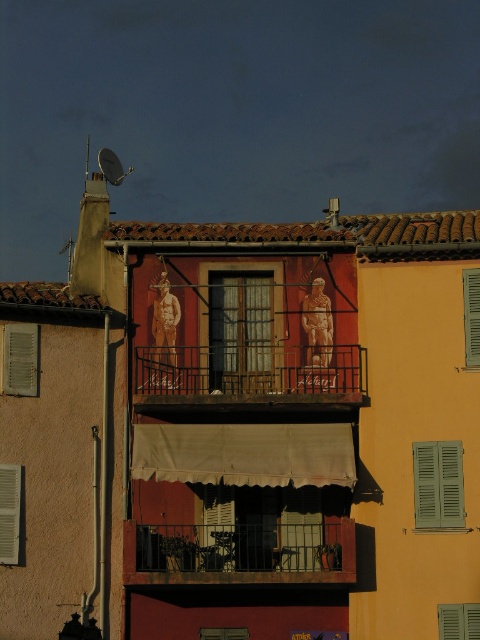
You are an architect analyzing the building facade. You notice the green matte shutters at center and the green matte shutter at lower right. Which one has a greater height?

The green matte shutters at center has a greater height compared to the green matte shutter at lower right.

You are a window cleaner needing to reach both the rustic metal balcony at center and the green matte shutter at lower right. Which object should you tackle first if you want to start with the taller one?

The rustic metal balcony at center is taller than the green matte shutter at lower right, so you should start with the rustic metal balcony at center.